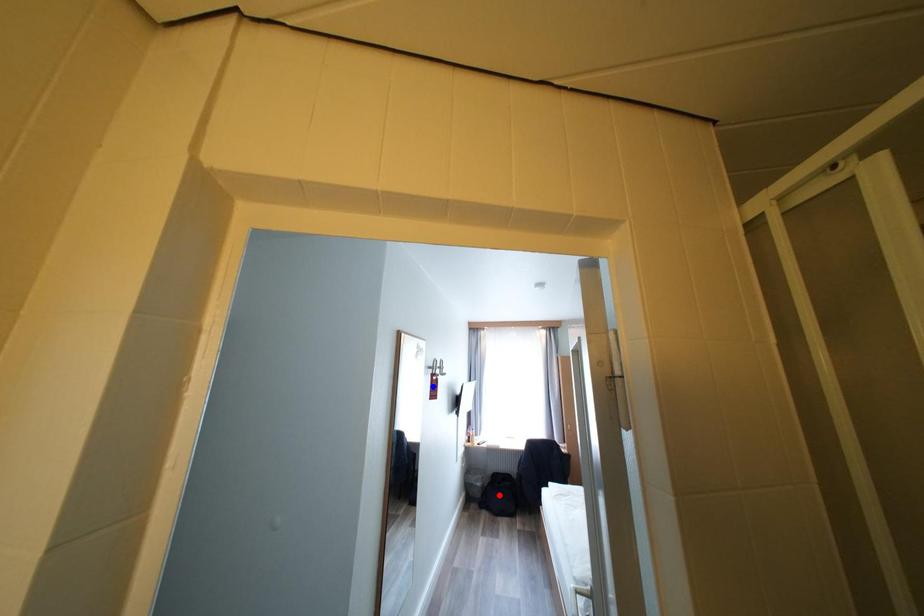
Question: Two points are marked on the image. Which point is closer to the camera?

Choices:
 (A) Blue point is closer.
 (B) Red point is closer.

Answer: (A)